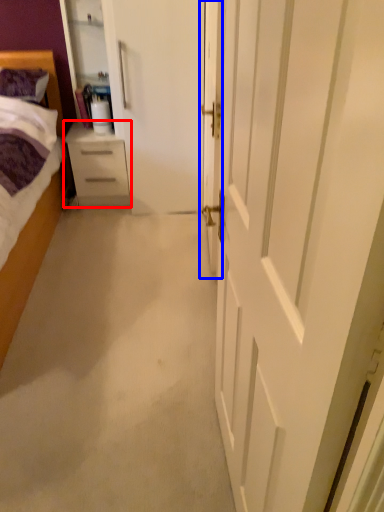
Question: Which object is further to the camera taking this photo, chest of drawers (highlighted by a red box) or door (highlighted by a blue box)?

Choices:
 (A) chest of drawers
 (B) door

Answer: (A)